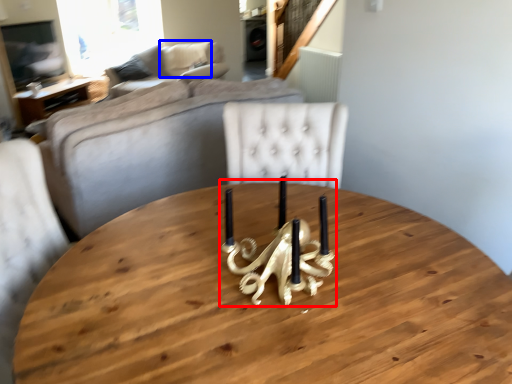
Question: Which object is further to the camera taking this photo, candle holder (highlighted by a red box) or pillow (highlighted by a blue box)?

Choices:
 (A) candle holder
 (B) pillow

Answer: (B)